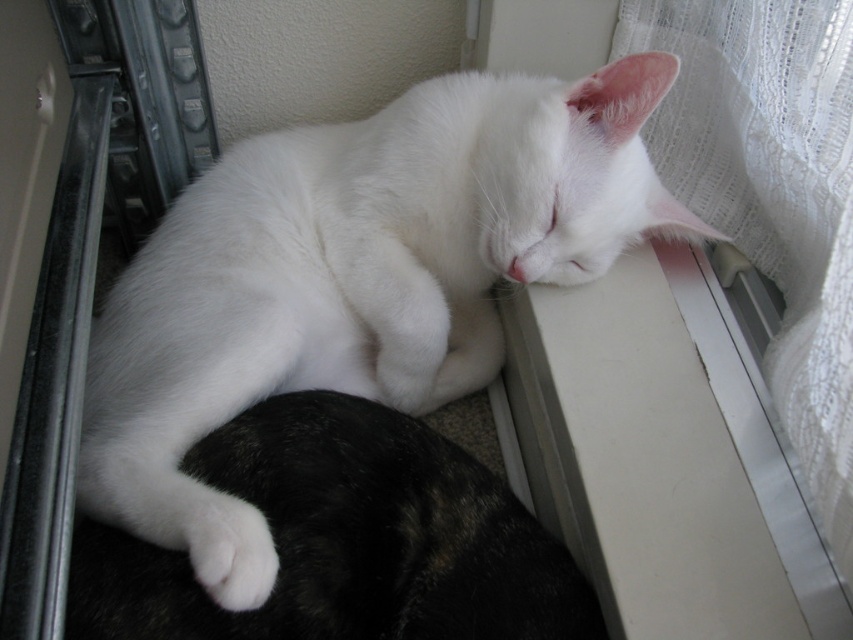
Question: Which of the following is the farthest from the observer?

Choices:
 (A) white fur at center
 (B) white fluffy cat at upper center
 (C) white lace curtain at upper right

Answer: (C)

Question: Does white fur at center appear on the right side of white lace curtain at upper right?

Choices:
 (A) no
 (B) yes

Answer: (A)

Question: Which point is closer to the camera taking this photo?

Choices:
 (A) (809, 460)
 (B) (315, 129)
 (C) (415, 506)

Answer: (A)

Question: Among these points, which one is farthest from the camera?

Choices:
 (A) (728, 161)
 (B) (311, 634)
 (C) (317, 141)

Answer: (C)

Question: Can you confirm if white fur at center is positioned above white lace curtain at upper right?

Choices:
 (A) no
 (B) yes

Answer: (A)

Question: Can you confirm if white fluffy cat at upper center is positioned above white fur at center?

Choices:
 (A) yes
 (B) no

Answer: (A)